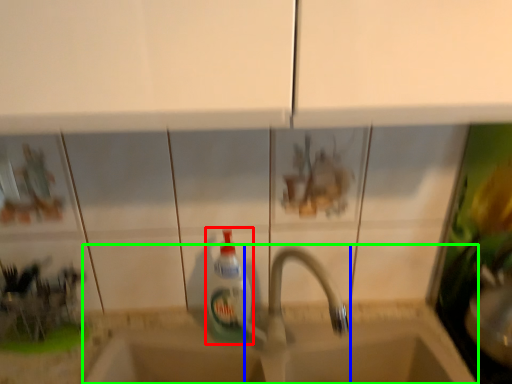
Question: Based on their relative distances, which object is nearer to bottle (highlighted by a red box)? Choose from tap (highlighted by a blue box) and sink (highlighted by a green box).

Choices:
 (A) tap
 (B) sink

Answer: (A)